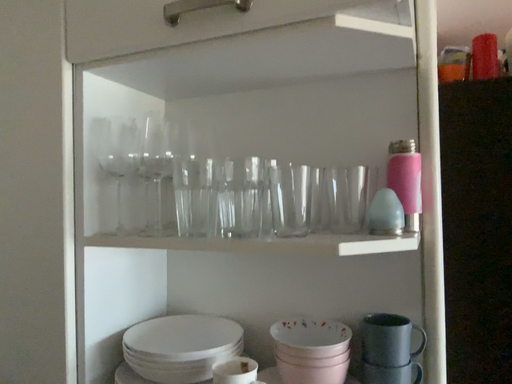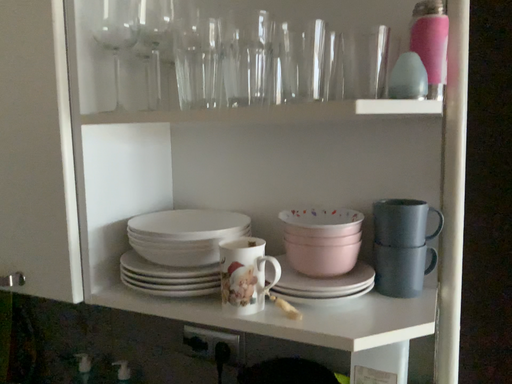
Question: How did the camera likely rotate when shooting the video?

Choices:
 (A) rotated downward
 (B) rotated upward

Answer: (A)